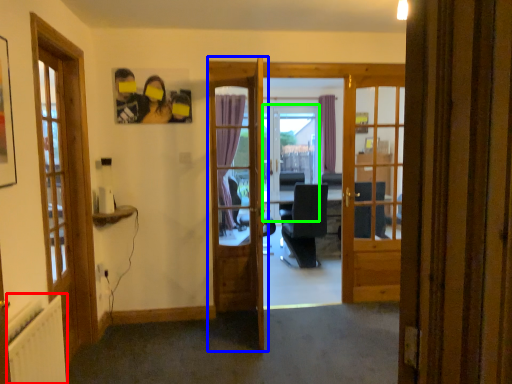
Question: Which object is positioned closest to radiator (highlighted by a red box)? Select from door (highlighted by a blue box) and screen door (highlighted by a green box).

Choices:
 (A) door
 (B) screen door

Answer: (A)